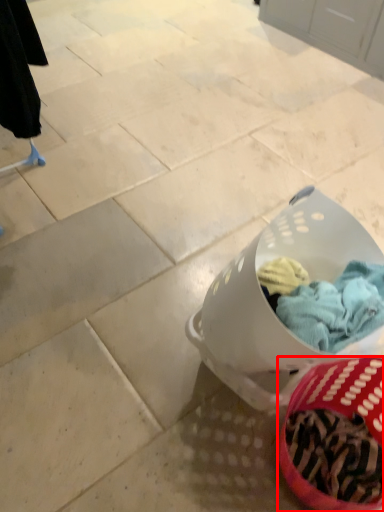
Question: From the image's perspective, where is basket (annotated by the red box) located relative to laundry basket?

Choices:
 (A) above
 (B) below

Answer: (B)